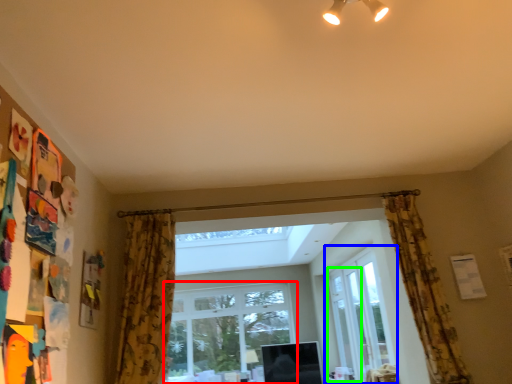
Question: Considering the real-world distances, which object is farthest from window (highlighted by a red box)? window (highlighted by a blue box) or screen door (highlighted by a green box)?

Choices:
 (A) window
 (B) screen door

Answer: (A)